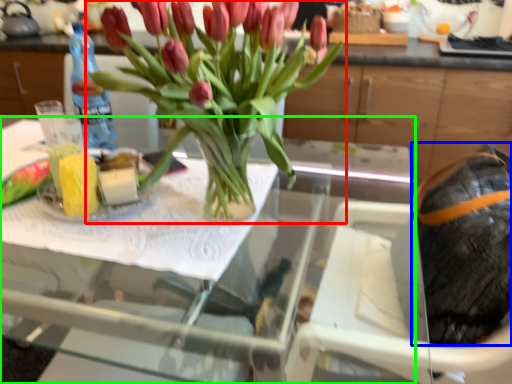
Question: Based on their relative distances, which object is nearer to houseplant (highlighted by a red box)? Choose from material (highlighted by a blue box) and table (highlighted by a green box).

Choices:
 (A) material
 (B) table

Answer: (B)